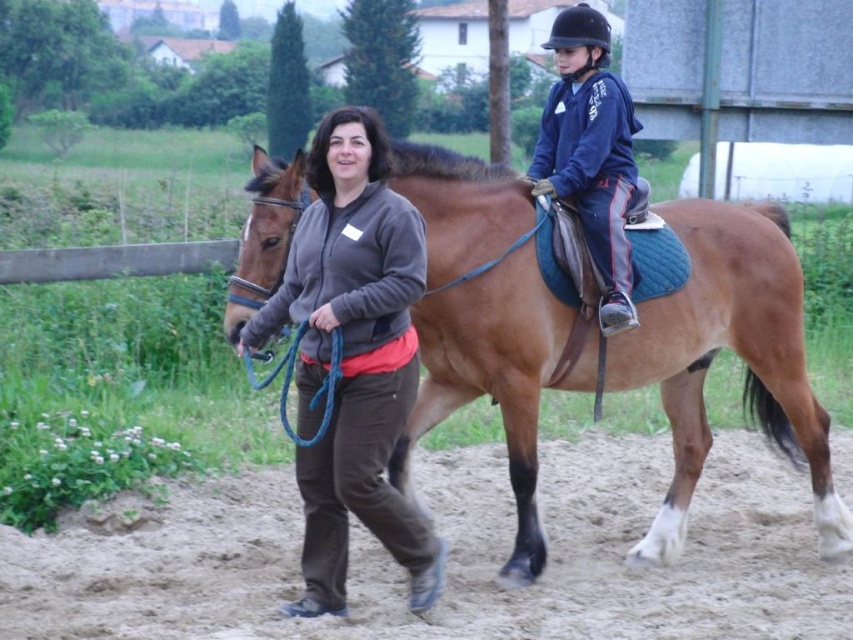
Which is more to the right, brown sandy dirt track at lower center or dark gray fleece jacket at center?

brown sandy dirt track at lower center is more to the right.

Can you confirm if brown sandy dirt track at lower center is wider than dark gray fleece jacket at center?

Indeed, brown sandy dirt track at lower center has a greater width compared to dark gray fleece jacket at center.

Which is behind, point (393, 621) or point (360, 260)?

Point (393, 621)

The image size is (853, 640). Identify the location of brown sandy dirt track at lower center. (450, 557).

Between brown leather saddle at center and dark gray fleece jacket at center, which one appears on the left side from the viewer's perspective?

Positioned to the left is dark gray fleece jacket at center.

Is brown leather saddle at center to the left of dark gray fleece jacket at center from the viewer's perspective?

Incorrect, brown leather saddle at center is not on the left side of dark gray fleece jacket at center.

The height and width of the screenshot is (640, 853). Identify the location of brown leather saddle at center. (735, 352).

This screenshot has height=640, width=853. What are the coordinates of `brown leather saddle at center` in the screenshot? It's located at (735, 352).

Does dark gray fleece jacket at center have a smaller size compared to blue fleece jacket at upper center?

No.

At what (x,y) coordinates should I click in order to perform the action: click on dark gray fleece jacket at center. Please return your answer as a coordinate pair (x, y). The height and width of the screenshot is (640, 853). Looking at the image, I should click on (352, 356).